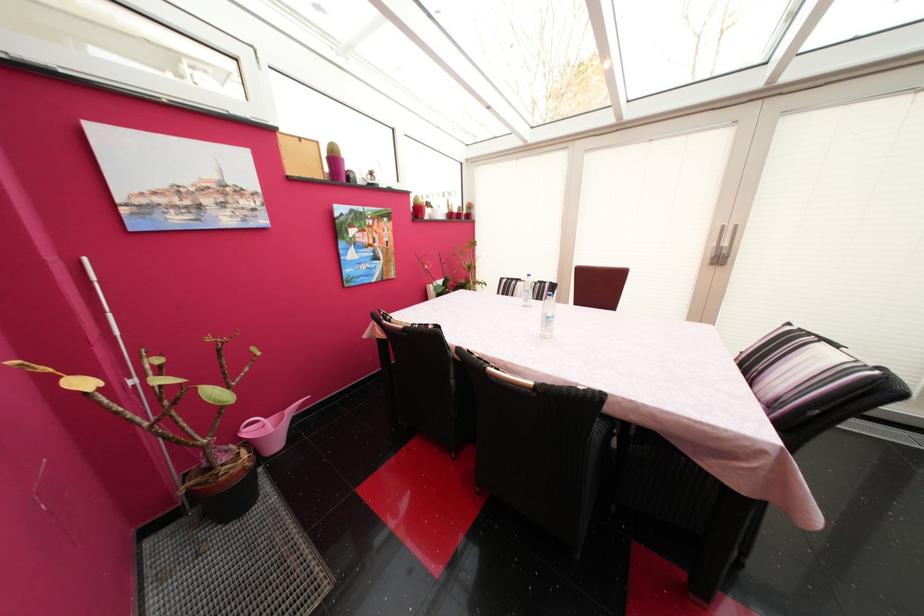
Where is `striped pillow`? striped pillow is located at coordinates tap(795, 365).